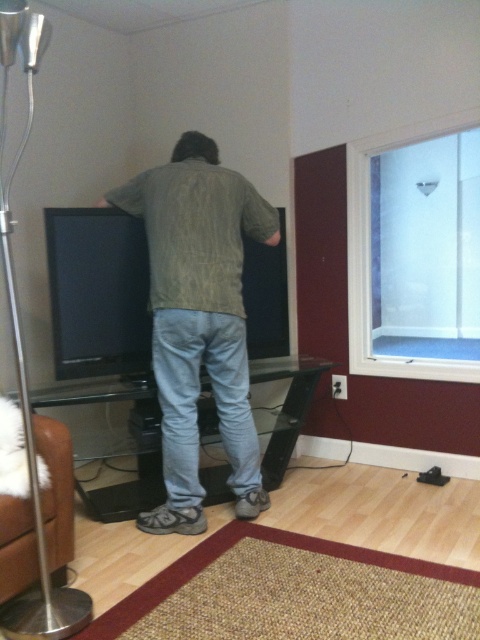
Question: Which point is farther to the camera?

Choices:
 (A) green textured shirt at center
 (B) clear glass window at upper right

Answer: (B)

Question: Which point is closer to the camera taking this photo?

Choices:
 (A) (240, 376)
 (B) (405, 365)

Answer: (A)

Question: Is green textured shirt at center smaller than clear glass window at upper right?

Choices:
 (A) no
 (B) yes

Answer: (A)

Question: Which of the following is the farthest from the observer?

Choices:
 (A) (377, 138)
 (B) (196, 195)

Answer: (A)

Question: Does green textured shirt at center lie behind clear glass window at upper right?

Choices:
 (A) yes
 (B) no

Answer: (B)

Question: Can you confirm if green textured shirt at center is bigger than clear glass window at upper right?

Choices:
 (A) yes
 (B) no

Answer: (A)